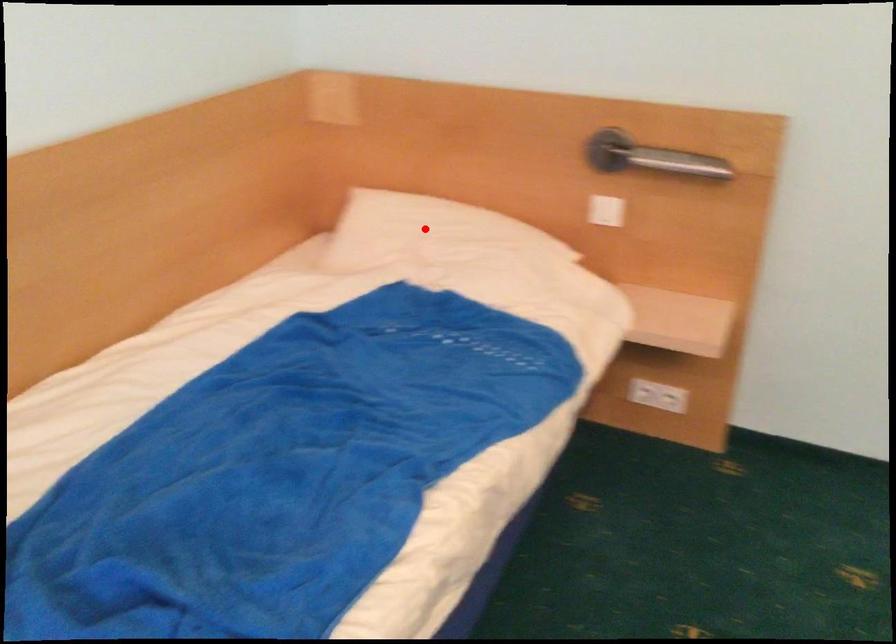
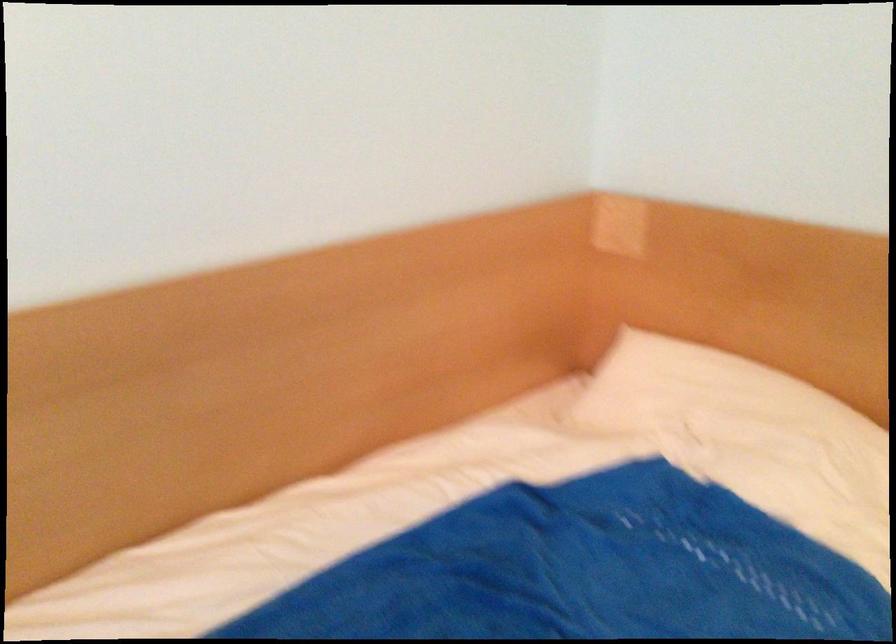
Question: I am providing you with two images of the same scene from different viewpoints. Image1 has a red point marked. In image2, the corresponding 3D location appears at what relative position? Reply with the corresponding letter.

Choices:
 (A) Closer
 (B) Farther

Answer: (A)